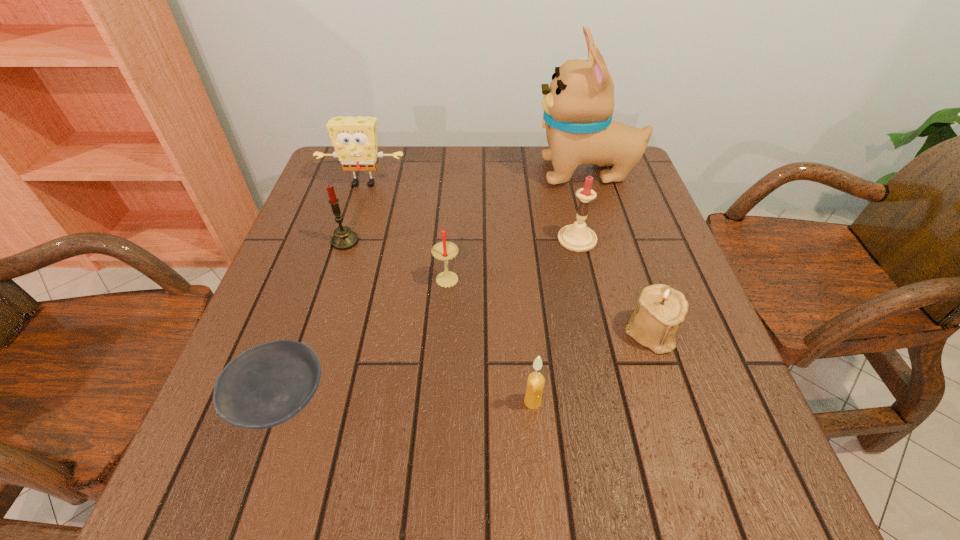
Find the location of a particular element. The image size is (960, 540). puppy at the far edge is located at coordinates (578, 104).

This screenshot has height=540, width=960. In order to click on sponge that is at the far edge in this screenshot , I will do `click(354, 138)`.

In order to click on sponge that is at the left edge in this screenshot , I will do `click(354, 138)`.

Find the location of `candle located at the left edge`. candle located at the left edge is located at coordinates (343, 239).

What are the coordinates of `bowl located in the left edge section of the desktop` in the screenshot? It's located at (265, 386).

Where is `puppy at the right edge`? This screenshot has width=960, height=540. puppy at the right edge is located at coordinates (578, 104).

You are a GUI agent. You are given a task and a screenshot of the screen. Output one action in this format:
    pyautogui.click(x=<x>, y=<y>)
    Task: Click on the candle_holder located in the right edge section of the desktop
    
    Given the screenshot: What is the action you would take?
    pyautogui.click(x=661, y=308)

This screenshot has height=540, width=960. I want to click on object present at the far left corner, so click(x=354, y=138).

Identify the location of object at the far right corner. The height and width of the screenshot is (540, 960). (578, 104).

What are the coordinates of `free space at the far edge of the desktop` in the screenshot? It's located at coord(396,177).